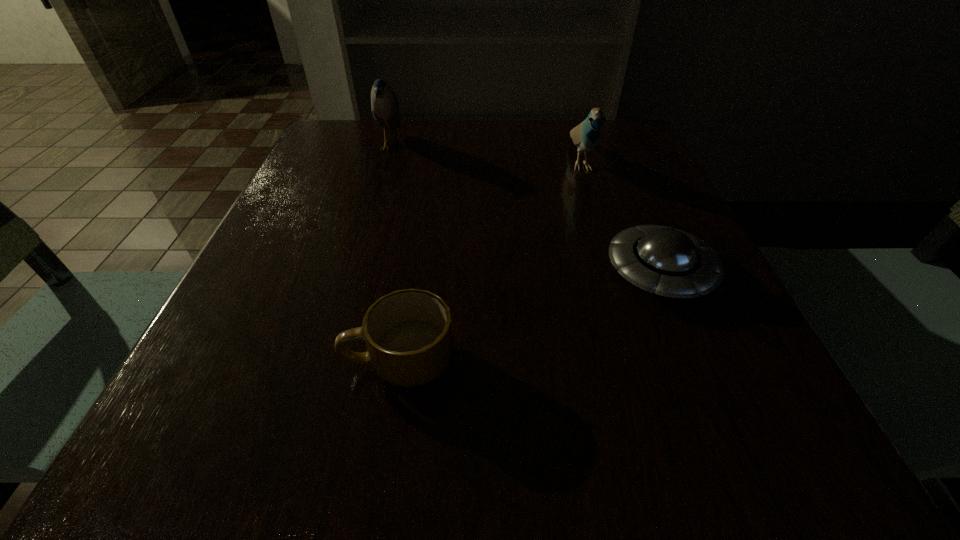
Find the location of a particular element. The height and width of the screenshot is (540, 960). free location at the far left corner is located at coordinates (361, 142).

Where is `free spot at the near left corner of the desktop`? The image size is (960, 540). free spot at the near left corner of the desktop is located at coordinates point(164,457).

Find the location of `vacant space at the far right corner of the desktop`. vacant space at the far right corner of the desktop is located at coordinates (625, 129).

Locate an element on the screen. The height and width of the screenshot is (540, 960). empty space that is in between the left bird and the right bird is located at coordinates coord(485,154).

Where is `vacant space in between the nearest object and the left bird`? Image resolution: width=960 pixels, height=540 pixels. vacant space in between the nearest object and the left bird is located at coordinates (396, 253).

Identify the location of unoccupied position between the right bird and the saucer. The width and height of the screenshot is (960, 540). (x=620, y=217).

Where is `unoccupied area between the leftmost object and the right bird`? unoccupied area between the leftmost object and the right bird is located at coordinates (485, 154).

You are a GUI agent. You are given a task and a screenshot of the screen. Output one action in this format:
    pyautogui.click(x=<x>, y=<y>)
    Task: Click on the empty location between the left bird and the mug
    The image size is (960, 540).
    Given the screenshot: What is the action you would take?
    pyautogui.click(x=396, y=253)

Find the location of a particular element. The width and height of the screenshot is (960, 540). vacant space that is in between the third farthest object and the leftmost object is located at coordinates (525, 209).

Find the location of a particular element. free point between the mug and the right bird is located at coordinates (490, 261).